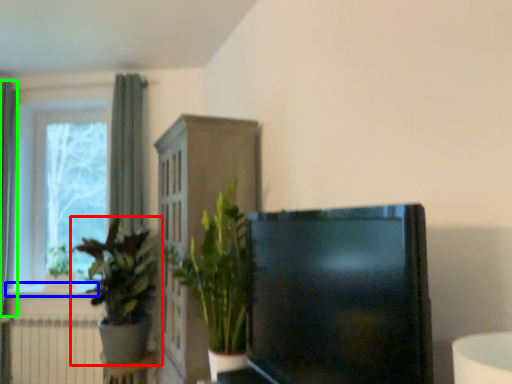
Question: Based on their relative distances, which object is nearer to houseplant (highlighted by a red box)? Choose from window sill (highlighted by a blue box) and curtain (highlighted by a green box).

Choices:
 (A) window sill
 (B) curtain

Answer: (A)